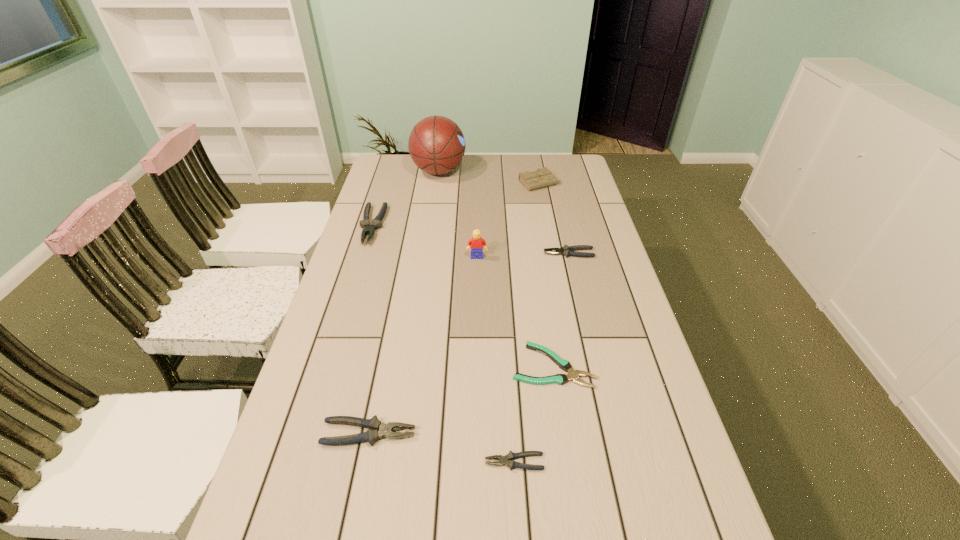
Find the location of a particular element. object at the far left corner is located at coordinates (436, 144).

Identify the location of object at the far right corner. This screenshot has height=540, width=960. (542, 177).

Locate an element on the screen. This screenshot has width=960, height=540. free space at the far edge of the desktop is located at coordinates pyautogui.click(x=429, y=179).

In the image, there is a desktop. Where is `free space at the left edge`? This screenshot has width=960, height=540. free space at the left edge is located at coordinates (392, 246).

Where is `blank space at the right edge of the desktop`? This screenshot has width=960, height=540. blank space at the right edge of the desktop is located at coordinates (637, 367).

The height and width of the screenshot is (540, 960). I want to click on empty space between the Lego and the seventh nearest object, so click(424, 241).

Where is `free space between the farthest gray pliers and the bigger teal pliers`? The image size is (960, 540). free space between the farthest gray pliers and the bigger teal pliers is located at coordinates (463, 295).

Image resolution: width=960 pixels, height=540 pixels. In order to click on vacant space that is in between the farthest pliers and the smallest gray pliers in this screenshot , I will do `click(444, 343)`.

The image size is (960, 540). In order to click on empty space that is in between the third tallest object and the tallest pliers in this screenshot , I will do `click(456, 204)`.

Image resolution: width=960 pixels, height=540 pixels. I want to click on free space that is in between the smallest gray pliers and the eighth shortest object, so click(x=495, y=360).